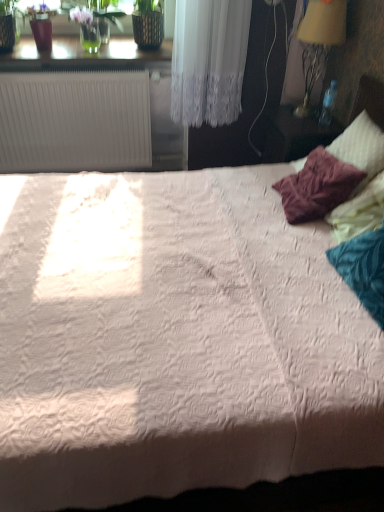
What do you see at coordinates (74, 121) in the screenshot? Image resolution: width=384 pixels, height=512 pixels. I see `white plastic radiator at upper left` at bounding box center [74, 121].

Where is `white plastic radiator at upper left`? This screenshot has height=512, width=384. white plastic radiator at upper left is located at coordinates (74, 121).

Is white plastic radiator at upper left completely or partially inside matte wooden nightstand at right?

That's incorrect, white plastic radiator at upper left is not inside matte wooden nightstand at right.

Considering the relative positions of matte wooden nightstand at right and white plastic radiator at upper left in the image provided, is matte wooden nightstand at right to the left of white plastic radiator at upper left from the viewer's perspective?

No.

Does point (299, 147) appear closer or farther from the camera than point (72, 104)?

Point (299, 147).

Does point (304, 56) lie in front of point (322, 144)?

No, (304, 56) is behind (322, 144).

From a real-world perspective, who is located higher, yellow fabric lampshade at upper right or matte wooden nightstand at right?

yellow fabric lampshade at upper right.

Who is shorter, yellow fabric lampshade at upper right or matte wooden nightstand at right?

matte wooden nightstand at right is shorter.

Is matte wooden nightstand at right located outside yellow fabric lampshade at upper right?

Yes, matte wooden nightstand at right is located beyond the bounds of yellow fabric lampshade at upper right.

Considering the sizes of matte wooden nightstand at right and yellow fabric lampshade at upper right in the image, is matte wooden nightstand at right bigger or smaller than yellow fabric lampshade at upper right?

Considering their sizes, matte wooden nightstand at right takes up more space than yellow fabric lampshade at upper right.

Is matte wooden nightstand at right at the left side of yellow fabric lampshade at upper right?

Yes.

In terms of width, does matte wooden nightstand at right look wider or thinner when compared to yellow fabric lampshade at upper right?

Considering their sizes, matte wooden nightstand at right looks broader than yellow fabric lampshade at upper right.

Is white plastic radiator at upper left located outside matte wooden nightstand at right?

Yes.

Considering the relative sizes of white plastic radiator at upper left and matte wooden nightstand at right in the image provided, is white plastic radiator at upper left bigger than matte wooden nightstand at right?

Yes.

From a real-world perspective, is white plastic radiator at upper left on matte wooden nightstand at right?

No.

How many degrees apart are the facing directions of white plastic radiator at upper left and matte wooden nightstand at right?

The angle between the facing direction of white plastic radiator at upper left and the facing direction of matte wooden nightstand at right is 88.7 degrees.

Does yellow fabric lampshade at upper right have a lesser height compared to white plastic radiator at upper left?

Correct, yellow fabric lampshade at upper right is not as tall as white plastic radiator at upper left.

Which is correct: yellow fabric lampshade at upper right is inside white plastic radiator at upper left, or outside of it?

yellow fabric lampshade at upper right lies outside white plastic radiator at upper left.

Does point (309, 57) appear closer or farther from the camera than point (34, 112)?

Point (309, 57) is closer to the camera than point (34, 112).

From the picture: Between white plastic radiator at upper left and yellow fabric lampshade at upper right, which one has smaller size?

With smaller size is yellow fabric lampshade at upper right.

Is white plastic radiator at upper left wider than yellow fabric lampshade at upper right?

Yes.

Between white plastic radiator at upper left and yellow fabric lampshade at upper right, which one appears on the left side from the viewer's perspective?

Positioned to the left is white plastic radiator at upper left.

Is the surface of white plastic radiator at upper left in direct contact with yellow fabric lampshade at upper right?

white plastic radiator at upper left and yellow fabric lampshade at upper right are not in contact.

Identify the location of radiator below the matte wooden nightstand at right (from a real-world perspective). The width and height of the screenshot is (384, 512). (74, 121).

This screenshot has width=384, height=512. In order to click on table that appears below the yellow fabric lampshade at upper right (from the image's perspective) in this screenshot , I will do `click(294, 134)`.

Consider the image. When comparing their distances from yellow fabric lampshade at upper right, does white plastic radiator at upper left or matte wooden nightstand at right seem further?

white plastic radiator at upper left is positioned further to the anchor yellow fabric lampshade at upper right.

From the image, which object appears to be farther from yellow fabric lampshade at upper right, matte wooden nightstand at right or white plastic radiator at upper left?

white plastic radiator at upper left lies further to yellow fabric lampshade at upper right than the other object.

When comparing their distances from white plastic radiator at upper left, does matte wooden nightstand at right or yellow fabric lampshade at upper right seem closer?

matte wooden nightstand at right is positioned closer to the anchor white plastic radiator at upper left.

From the image, which object appears to be farther from white plastic radiator at upper left, yellow fabric lampshade at upper right or matte wooden nightstand at right?

yellow fabric lampshade at upper right lies further to white plastic radiator at upper left than the other object.

Which object lies nearer to the anchor point matte wooden nightstand at right, yellow fabric lampshade at upper right or white plastic radiator at upper left?

yellow fabric lampshade at upper right lies closer to matte wooden nightstand at right than the other object.

Estimate the real-world distances between objects in this image. Which object is closer to matte wooden nightstand at right, white plastic radiator at upper left or yellow fabric lampshade at upper right?

Based on the image, yellow fabric lampshade at upper right appears to be nearer to matte wooden nightstand at right.

You are a GUI agent. You are given a task and a screenshot of the screen. Output one action in this format:
    pyautogui.click(x=<x>, y=<y>)
    Task: Click on the table located between white plastic radiator at upper left and yellow fabric lampshade at upper right in the left-right direction
    
    Given the screenshot: What is the action you would take?
    pyautogui.click(x=294, y=134)